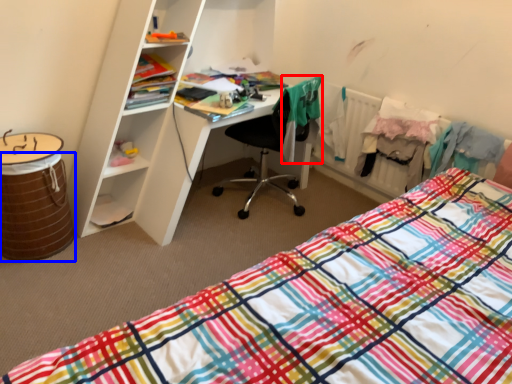
Question: Which point is closer to the camera, clothing (highlighted by a red box) or barrel (highlighted by a blue box)?

Choices:
 (A) clothing
 (B) barrel

Answer: (B)